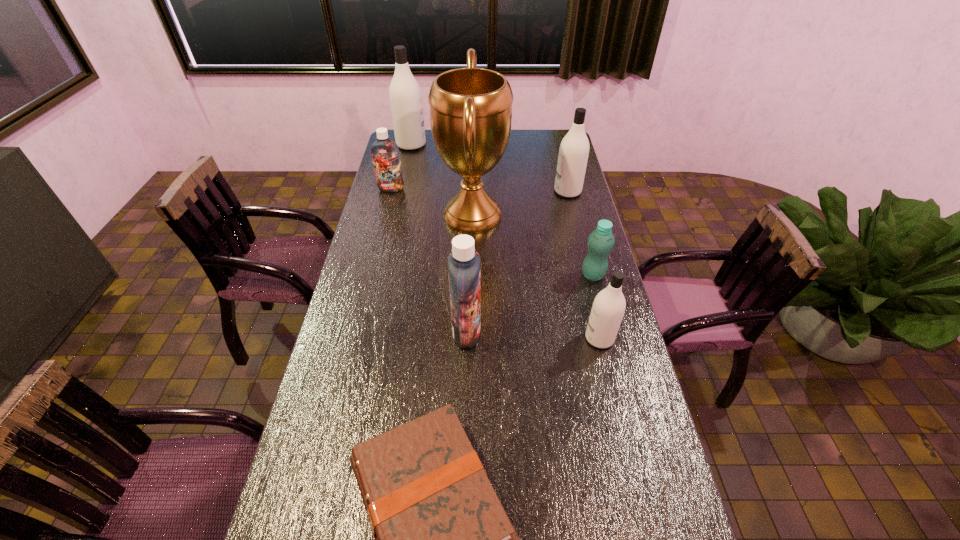
Locate an element on the screen. water bottle is located at coordinates (601, 241).

At what (x,y) coordinates should I click in order to perform the action: click on the fifth farthest object. Please return your answer as a coordinate pair (x, y). Looking at the image, I should click on (601, 241).

This screenshot has width=960, height=540. I want to click on vacant region located 0.180m on the surface of the trophy cup with symbols, so click(x=552, y=215).

This screenshot has height=540, width=960. I want to click on free space located 0.100m on the front-facing side of the second tallest object, so click(x=446, y=145).

This screenshot has width=960, height=540. I want to click on vacant space located 0.130m on the front label of the third shampoo from right to left, so click(x=523, y=332).

Locate an element on the screen. The height and width of the screenshot is (540, 960). vacant space located 0.310m on the front-facing side of the second farthest white shampoo is located at coordinates tap(481, 191).

In order to click on vacant area located 0.350m on the front-facing side of the second farthest white shampoo in this screenshot , I will do `click(471, 191)`.

I want to click on vacant space located 0.380m on the front-facing side of the second farthest white shampoo, so click(465, 191).

Locate an element on the screen. This screenshot has width=960, height=540. vacant position located 0.400m on the front-facing side of the smallest white shampoo is located at coordinates (452, 338).

At what (x,y) coordinates should I click in order to perform the action: click on vacant point located on the front-facing side of the smallest white shampoo. Please return your answer as a coordinate pair (x, y). Image resolution: width=960 pixels, height=540 pixels. Looking at the image, I should click on (472, 338).